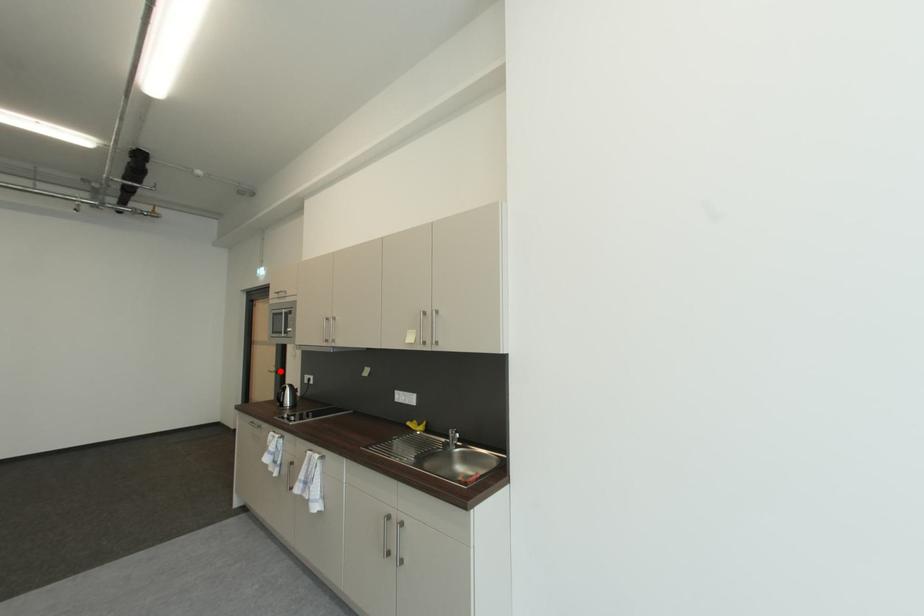
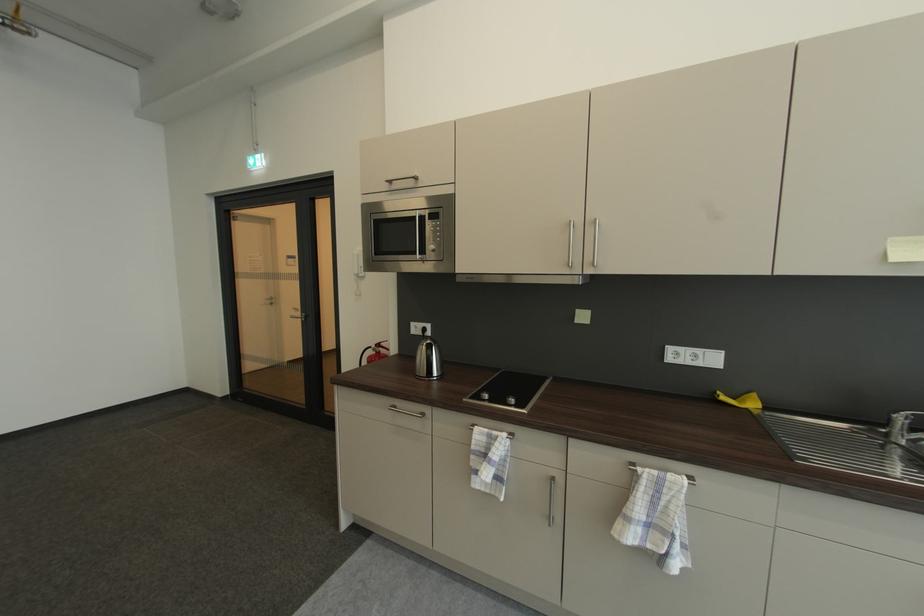
The point at the highlighted location is marked in the first image. Where is the corresponding point in the second image?

(305, 315)